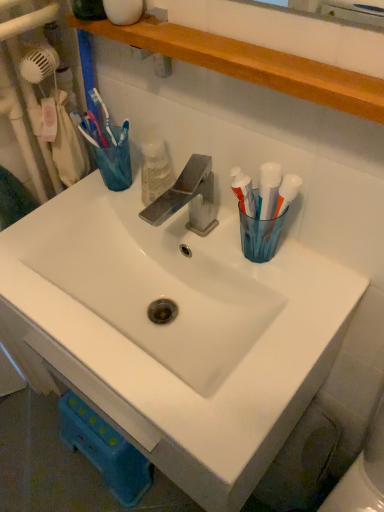
What do you see at coordinates (252, 64) in the screenshot? I see `wooden shelf at upper center` at bounding box center [252, 64].

The height and width of the screenshot is (512, 384). In order to click on white ceramic sink at center in this screenshot , I will do `click(173, 332)`.

At what (x,y) coordinates should I click in order to perform the action: click on translucent plastic toothbrush at upper left. Please return your answer as a coordinate pair (x, y). Looking at the image, I should click on (93, 132).

From a real-world perspective, between wooden shelf at upper center and white ceramic sink at center, who is vertically lower?

white ceramic sink at center, from a real-world perspective.

Based on their sizes in the image, would you say wooden shelf at upper center is bigger or smaller than white ceramic sink at center?

Considering their sizes, wooden shelf at upper center takes up less space than white ceramic sink at center.

Considering the sizes of wooden shelf at upper center and white ceramic sink at center in the image, is wooden shelf at upper center taller or shorter than white ceramic sink at center?

wooden shelf at upper center is shorter than white ceramic sink at center.

Considering the positions of objects wooden shelf at upper center and white ceramic sink at center in the image provided, who is behind, wooden shelf at upper center or white ceramic sink at center?

white ceramic sink at center is further away from the camera.

The image size is (384, 512). What are the coordinates of `shelve in front of the white ceramic sink at center` in the screenshot? It's located at (x=252, y=64).

Is white ceramic sink at center not close to wooden shelf at upper center?

No, white ceramic sink at center is not far from wooden shelf at upper center.

Can you confirm if white ceramic sink at center is positioned to the left of wooden shelf at upper center?

Correct, you'll find white ceramic sink at center to the left of wooden shelf at upper center.

What's the angular difference between white ceramic sink at center and wooden shelf at upper center's facing directions?

white ceramic sink at center and wooden shelf at upper center are facing 0.191 degrees away from each other.

Looking at this image, what's the angular difference between wooden shelf at upper center and translucent plastic toothbrush at upper left's facing directions?

The facing directions of wooden shelf at upper center and translucent plastic toothbrush at upper left are 2.47 degrees apart.

Is translucent plastic toothbrush at upper left surrounded by wooden shelf at upper center?

Actually, translucent plastic toothbrush at upper left is outside wooden shelf at upper center.

Who is smaller, wooden shelf at upper center or translucent plastic toothbrush at upper left?

Smaller between the two is translucent plastic toothbrush at upper left.

Between wooden shelf at upper center and translucent plastic toothbrush at upper left, which one appears on the left side from the viewer's perspective?

translucent plastic toothbrush at upper left.

From the image's perspective, between translucent plastic toothbrush at upper left and wooden shelf at upper center, who is located below?

From the image's view, translucent plastic toothbrush at upper left is below.

How far apart are translucent plastic toothbrush at upper left and wooden shelf at upper center?

A distance of 13.37 inches exists between translucent plastic toothbrush at upper left and wooden shelf at upper center.

Is translucent plastic toothbrush at upper left directly adjacent to wooden shelf at upper center?

translucent plastic toothbrush at upper left and wooden shelf at upper center are not in contact.

Which object is thinner, translucent plastic toothbrush at upper left or white ceramic sink at center?

translucent plastic toothbrush at upper left is thinner.

Is point (96, 142) positioned behind point (108, 341)?

Yes, it is.

Considering the positions of objects translucent plastic toothbrush at upper left and white ceramic sink at center in the image provided, who is behind, translucent plastic toothbrush at upper left or white ceramic sink at center?

translucent plastic toothbrush at upper left is more distant.

Is translucent plastic toothbrush at upper left facing towards white ceramic sink at center?

No, translucent plastic toothbrush at upper left is not turned towards white ceramic sink at center.

From the image's perspective, which is above, white ceramic sink at center or translucent plastic toothbrush at upper left?

translucent plastic toothbrush at upper left appears higher in the image.

Consider the image. Is white ceramic sink at center with translucent plastic toothbrush at upper left?

white ceramic sink at center and translucent plastic toothbrush at upper left are clearly separated.

How many degrees apart are the facing directions of white ceramic sink at center and translucent plastic toothbrush at upper left?

The facing directions of white ceramic sink at center and translucent plastic toothbrush at upper left are 2.28 degrees apart.

Where is `shelve above the white ceramic sink at center (from the image's perspective)`? Image resolution: width=384 pixels, height=512 pixels. shelve above the white ceramic sink at center (from the image's perspective) is located at coordinates (252, 64).

Image resolution: width=384 pixels, height=512 pixels. There is a white ceramic sink at center. Find the location of `shelve above it (from a real-world perspective)`. shelve above it (from a real-world perspective) is located at coordinates (252, 64).

Considering their positions, is white ceramic sink at center positioned further to translucent plastic toothbrush at upper left than wooden shelf at upper center?

white ceramic sink at center lies further to translucent plastic toothbrush at upper left than the other object.

When comparing their distances from white ceramic sink at center, does translucent plastic toothbrush at upper left or wooden shelf at upper center seem further?

The object further to white ceramic sink at center is wooden shelf at upper center.

When comparing their distances from translucent plastic toothbrush at upper left, does wooden shelf at upper center or white ceramic sink at center seem further?

white ceramic sink at center.

Estimate the real-world distances between objects in this image. Which object is closer to wooden shelf at upper center, translucent plastic toothbrush at upper left or white ceramic sink at center?

translucent plastic toothbrush at upper left is positioned closer to the anchor wooden shelf at upper center.

Considering their positions, is white ceramic sink at center positioned closer to wooden shelf at upper center than translucent plastic toothbrush at upper left?

translucent plastic toothbrush at upper left is positioned closer to the anchor wooden shelf at upper center.

Which object lies further to the anchor point white ceramic sink at center, wooden shelf at upper center or translucent plastic toothbrush at upper left?

wooden shelf at upper center is further to white ceramic sink at center.

Where is `toothbrush that lies between wooden shelf at upper center and white ceramic sink at center from top to bottom`? The width and height of the screenshot is (384, 512). toothbrush that lies between wooden shelf at upper center and white ceramic sink at center from top to bottom is located at coordinates (93, 132).